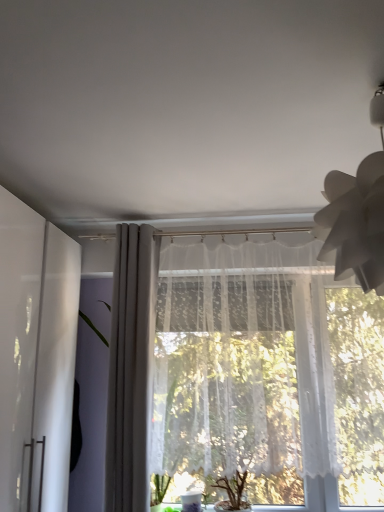
Question: Does white paper lampshade at upper right lie behind transparent glass vase at lower center?

Choices:
 (A) yes
 (B) no

Answer: (B)

Question: Is white paper lampshade at upper right in contact with transparent glass vase at lower center?

Choices:
 (A) no
 (B) yes

Answer: (A)

Question: Is white paper lampshade at upper right smaller than transparent glass vase at lower center?

Choices:
 (A) no
 (B) yes

Answer: (A)

Question: From a real-world perspective, does white paper lampshade at upper right sit lower than transparent glass vase at lower center?

Choices:
 (A) yes
 (B) no

Answer: (B)

Question: Can you confirm if white paper lampshade at upper right is bigger than transparent glass vase at lower center?

Choices:
 (A) no
 (B) yes

Answer: (B)

Question: Does white paper lampshade at upper right have a greater height compared to transparent glass vase at lower center?

Choices:
 (A) yes
 (B) no

Answer: (A)

Question: From a real-world perspective, is white paper lampshade at upper right below white lace curtain at center, which is the 1th curtain in right-to-left order?

Choices:
 (A) yes
 (B) no

Answer: (B)

Question: Does white paper lampshade at upper right lie in front of white lace curtain at center, positioned as the 2th curtain in left-to-right order?

Choices:
 (A) yes
 (B) no

Answer: (A)

Question: Is white paper lampshade at upper right positioned far away from white lace curtain at center, positioned as the 2th curtain in left-to-right order?

Choices:
 (A) yes
 (B) no

Answer: (A)

Question: Can you confirm if white paper lampshade at upper right is positioned to the left of white lace curtain at center, which is the 1th curtain in right-to-left order?

Choices:
 (A) yes
 (B) no

Answer: (B)

Question: Is white paper lampshade at upper right aimed at white lace curtain at center, which is the 1th curtain in right-to-left order?

Choices:
 (A) no
 (B) yes

Answer: (A)

Question: Is white paper lampshade at upper right thinner than white lace curtain at center, positioned as the 2th curtain in left-to-right order?

Choices:
 (A) no
 (B) yes

Answer: (A)

Question: From a real-world perspective, is white paper lampshade at upper right located higher than white glossy cabinet at left?

Choices:
 (A) no
 (B) yes

Answer: (B)